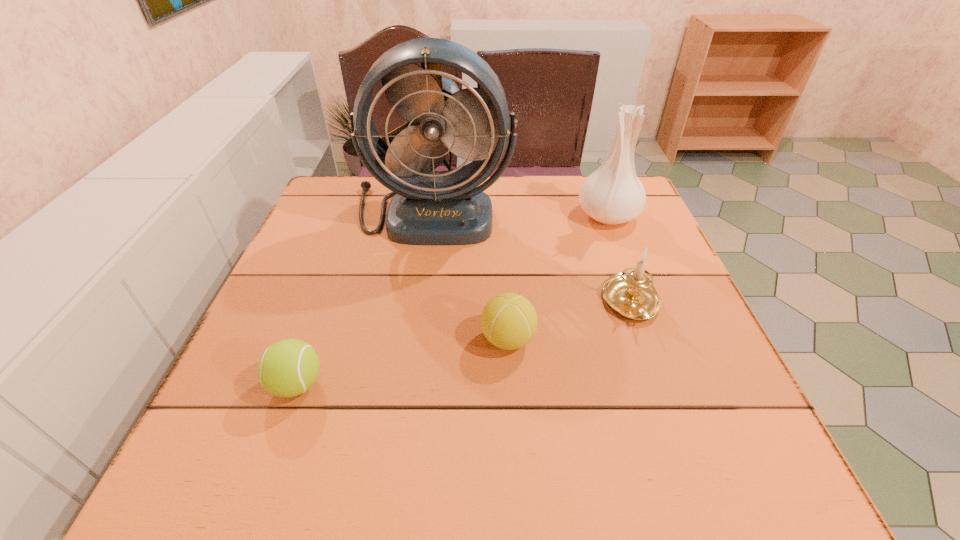
The width and height of the screenshot is (960, 540). Identify the location of the tallest object. (429, 207).

Where is `the second tallest object`? The image size is (960, 540). the second tallest object is located at coordinates (613, 194).

You are a GUI agent. You are given a task and a screenshot of the screen. Output one action in this format:
    pyautogui.click(x=<x>, y=<y>)
    Task: Click on the third shortest object
    The width and height of the screenshot is (960, 540).
    Given the screenshot: What is the action you would take?
    pyautogui.click(x=630, y=293)

In order to click on the farther tennis ball in this screenshot , I will do `click(509, 321)`.

Where is `the left tennis ball`? This screenshot has height=540, width=960. the left tennis ball is located at coordinates coord(289,367).

Find the location of a particular element. This screenshot has width=960, height=540. the nearest object is located at coordinates (289, 367).

The width and height of the screenshot is (960, 540). What are the coordinates of `vacant space located 0.270m in front of the fan to blow air` in the screenshot? It's located at (416, 330).

Where is `free spot located 0.180m on the front of the fourth shortest object`? free spot located 0.180m on the front of the fourth shortest object is located at coordinates (634, 283).

Image resolution: width=960 pixels, height=540 pixels. What are the coordinates of `vacant space located on the handle side of the third shortest object` in the screenshot? It's located at (668, 406).

This screenshot has height=540, width=960. What are the coordinates of `blank space located 0.240m on the back of the right tennis ball` in the screenshot? It's located at coord(502,246).